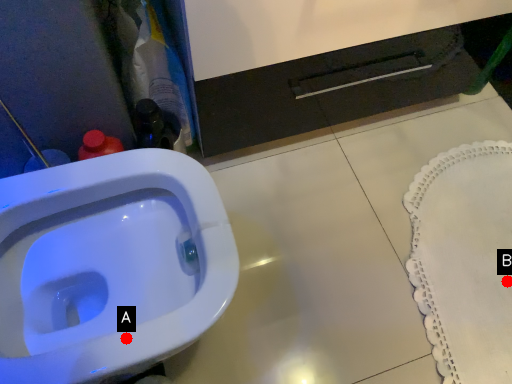
Question: Two points are circled on the image, labeled by A and B beside each circle. Which point is farther to the camera?

Choices:
 (A) A is further
 (B) B is further

Answer: (B)